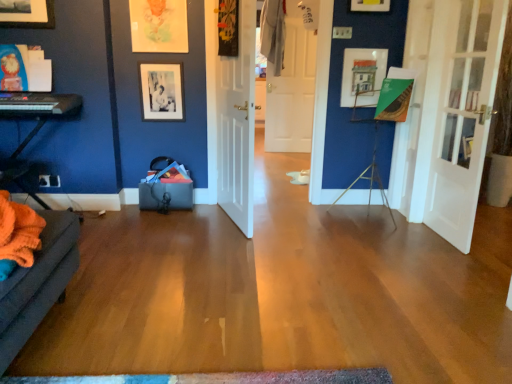
Identify the location of free spot to the right of multicolored woven mat at lower center. (364, 337).